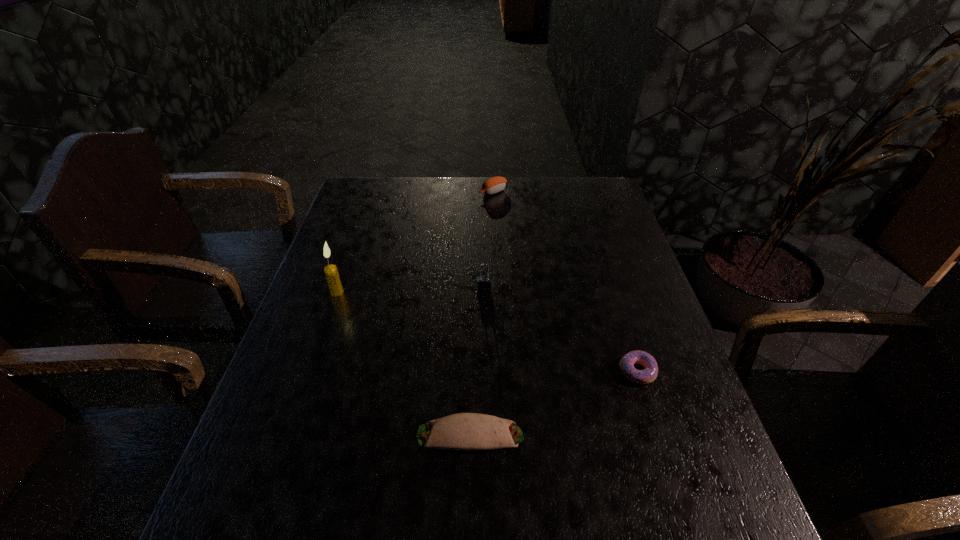
Where is `blank space located on the left of the third shortest object`? This screenshot has height=540, width=960. blank space located on the left of the third shortest object is located at coordinates (372, 192).

At what (x,y) coordinates should I click in order to perform the action: click on vacant space located on the back of the rightmost object. Please return your answer as a coordinate pair (x, y). Looking at the image, I should click on (619, 315).

The image size is (960, 540). What are the coordinates of `free space located 0.080m at the bitten end of the nearest object` in the screenshot? It's located at (564, 435).

Locate an element on the screen. The image size is (960, 540). object located in the far edge section of the desktop is located at coordinates (493, 185).

You are a GUI agent. You are given a task and a screenshot of the screen. Output one action in this format:
    pyautogui.click(x=<x>, y=<y>)
    Task: Click on the object at the left edge
    This screenshot has height=540, width=960.
    Given the screenshot: What is the action you would take?
    pyautogui.click(x=332, y=276)

In order to click on object that is positioned at the right edge in this screenshot , I will do `click(649, 374)`.

In the image, there is a desktop. Identify the location of vacant region at the far edge. (435, 212).

What are the coordinates of `vacant region at the near edge of the desktop` in the screenshot? It's located at (409, 517).

Where is `free region at the left edge of the desktop`? The width and height of the screenshot is (960, 540). free region at the left edge of the desktop is located at coordinates (324, 402).

In the image, there is a desktop. At what (x,y) coordinates should I click in order to perform the action: click on vacant region at the right edge. Please return your answer as a coordinate pair (x, y). Looking at the image, I should click on (658, 334).